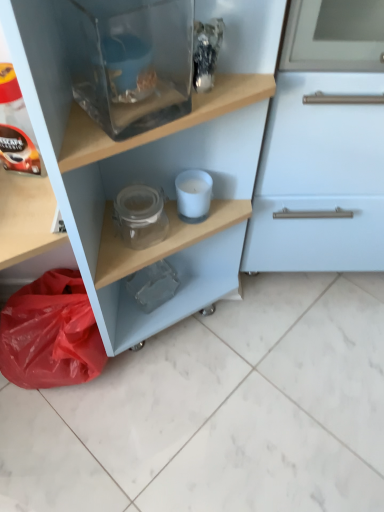
I want to click on free space in front of red plastic bag at lower left, so click(x=66, y=440).